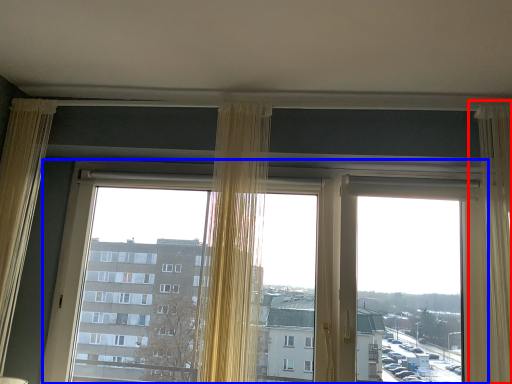
Question: Which point is closer to the camera, curtain (highlighted by a red box) or window (highlighted by a blue box)?

Choices:
 (A) curtain
 (B) window

Answer: (A)